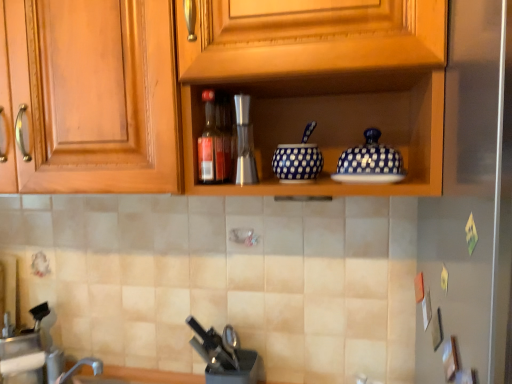
Question: Is point tap(361, 152) closer or farther from the camera than point tap(49, 168)?

Choices:
 (A) closer
 (B) farther

Answer: (A)

Question: In the image, is blue polka dot ceramic bowl at upper right positioned in front of or behind wooden cabinet at upper center?

Choices:
 (A) behind
 (B) front

Answer: (A)

Question: Estimate the real-world distances between objects in this image. Which object is closer to the matte glass bottle at center?

Choices:
 (A) silver metallic coffee machine at center
 (B) brushed metal faucet at lower left
 (C) black plastic knife block at lower center
 (D) blue polka dot ceramic bowl at upper right
 (E) wooden cabinet at upper center

Answer: (A)

Question: Estimate the real-world distances between objects in this image. Which object is closer to the black plastic knife block at lower center?

Choices:
 (A) wooden cabinet at upper center
 (B) blue dotted bowl at center
 (C) blue polka dot ceramic bowl at upper right
 (D) silver metallic coffee machine at center
 (E) brushed metal faucet at lower left

Answer: (E)